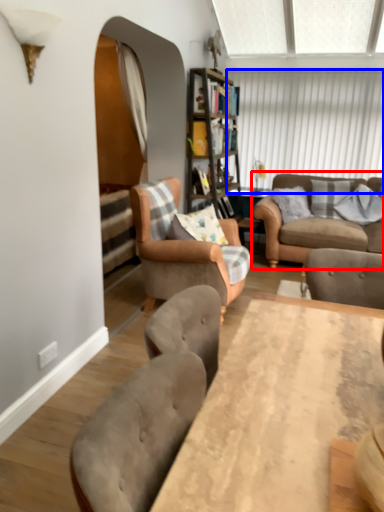
Question: Which object appears farthest to the camera in this image, studio couch (highlighted by a red box) or window screen (highlighted by a blue box)?

Choices:
 (A) studio couch
 (B) window screen

Answer: (B)